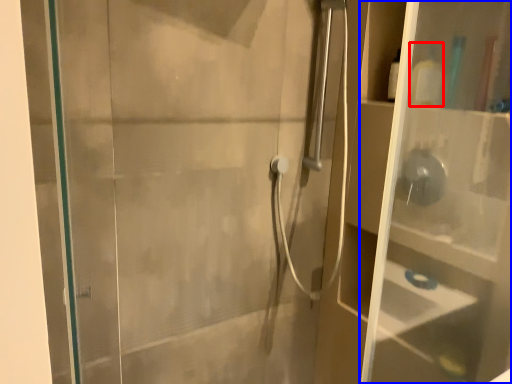
Question: Which point is further to the camera, toiletry (highlighted by a red box) or glass box (highlighted by a blue box)?

Choices:
 (A) toiletry
 (B) glass box

Answer: (A)